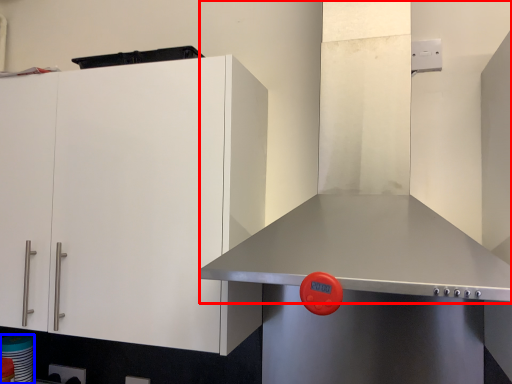
Question: Which object is further to the camera taking this photo, exhaust hood (highlighted by a red box) or appliance (highlighted by a blue box)?

Choices:
 (A) exhaust hood
 (B) appliance

Answer: (B)